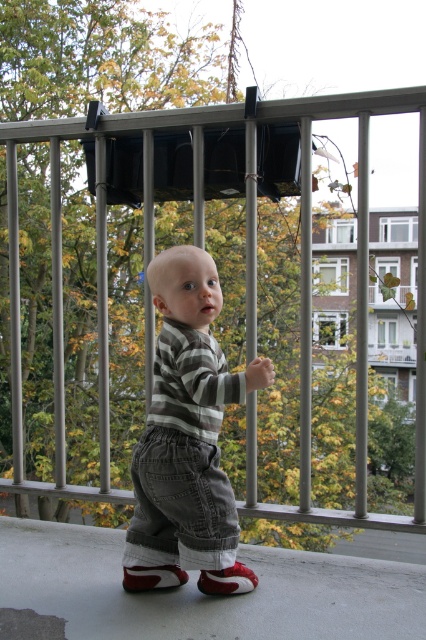
Can you confirm if smooth concrete ledge at center is bigger than red suede sneaker at center?

Correct, smooth concrete ledge at center is larger in size than red suede sneaker at center.

Between point (255, 561) and point (157, 570), which one is positioned behind?

The point (255, 561) is more distant.

Is point (347, 612) positioned after point (127, 576)?

No, it is in front of (127, 576).

This screenshot has height=640, width=426. In order to click on smooth concrete ledge at center in this screenshot , I will do `click(204, 595)`.

Between smooth concrete ledge at center and striped cotton shirt at center, which one appears on the right side from the viewer's perspective?

striped cotton shirt at center is more to the right.

Between smooth concrete ledge at center and striped cotton shirt at center, which one has more height?

striped cotton shirt at center is taller.

What do you see at coordinates (204, 595) in the screenshot? I see `smooth concrete ledge at center` at bounding box center [204, 595].

Locate an element on the screen. The height and width of the screenshot is (640, 426). smooth concrete ledge at center is located at coordinates (204, 595).

Can you confirm if striped cotton shirt at center is shorter than red suede sneaker at center?

No, striped cotton shirt at center is not shorter than red suede sneaker at center.

The width and height of the screenshot is (426, 640). I want to click on striped cotton shirt at center, so click(x=187, y=424).